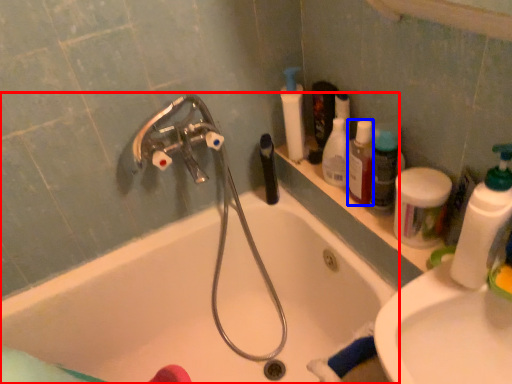
Question: Among these objects, which one is farthest to the camera, bathtub (highlighted by a red box) or mouthwash (highlighted by a blue box)?

Choices:
 (A) bathtub
 (B) mouthwash

Answer: (B)